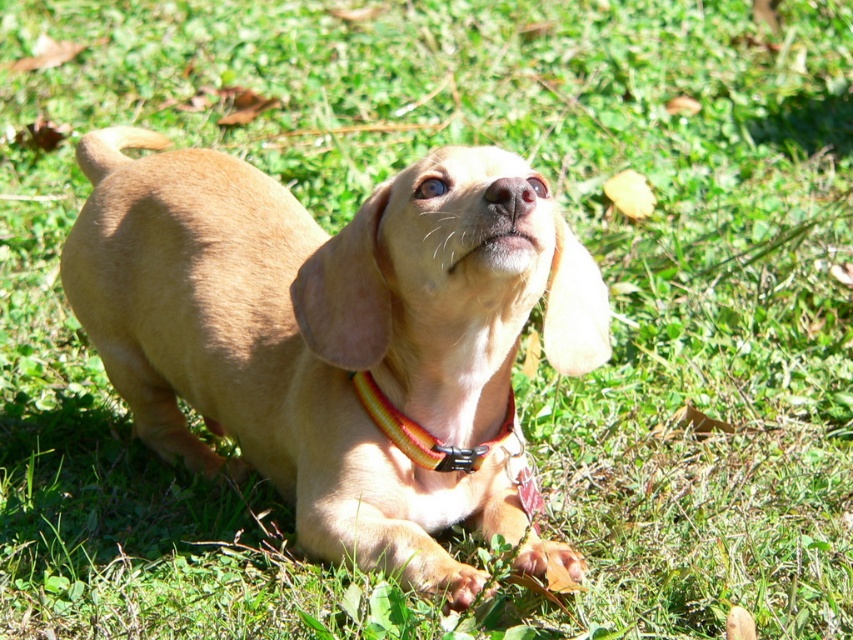
Which is more to the right, light brown fur at center or yellow/orange fabric collar at center?

yellow/orange fabric collar at center

Can you confirm if light brown fur at center is thinner than yellow/orange fabric collar at center?

In fact, light brown fur at center might be wider than yellow/orange fabric collar at center.

Who is more distant from viewer, (396,484) or (463,456)?

Positioned behind is point (396,484).

At what (x,y) coordinates should I click in order to perform the action: click on light brown fur at center. Please return your answer as a coordinate pair (x, y). Image resolution: width=853 pixels, height=640 pixels. Looking at the image, I should click on point(338,337).